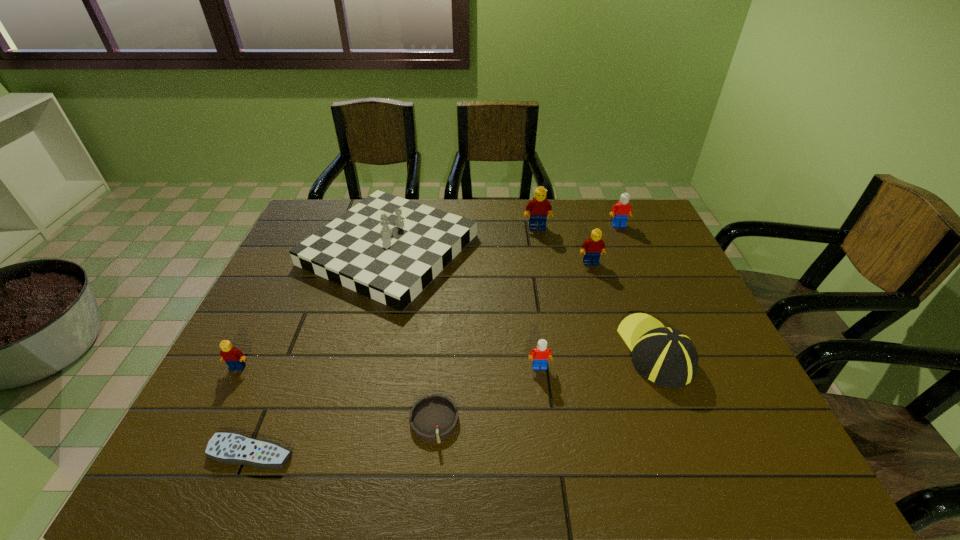
Where is `the left white Lego`? The image size is (960, 540). the left white Lego is located at coordinates (541, 354).

Locate an element on the screen. the smaller white Lego is located at coordinates (541, 354).

Where is `ashtray`? The width and height of the screenshot is (960, 540). ashtray is located at coordinates (433, 418).

Locate an element on the screen. The image size is (960, 540). the eighth tallest object is located at coordinates (433, 418).

I want to click on the shortest object, so click(x=226, y=447).

Find the location of a particular element. The image size is (960, 540). free location located on the front-facing side of the second yellow Lego from left to right is located at coordinates (543, 266).

At what (x,y) coordinates should I click in order to perform the action: click on vacant space located on the front of the black checkerboard. Please return your answer as a coordinate pair (x, y). Looking at the image, I should click on (342, 434).

Where is `vacant region located 0.090m on the face of the right white Lego`? vacant region located 0.090m on the face of the right white Lego is located at coordinates (627, 244).

At what (x,y) coordinates should I click in order to perform the action: click on free space located 0.090m on the front-facing side of the rightmost yellow Lego. Please return your answer as a coordinate pair (x, y). The image size is (960, 540). Looking at the image, I should click on [x=598, y=286].

This screenshot has width=960, height=540. In order to click on free space located 0.400m with the brim of the baseball cap facing forward in this screenshot , I will do `click(610, 230)`.